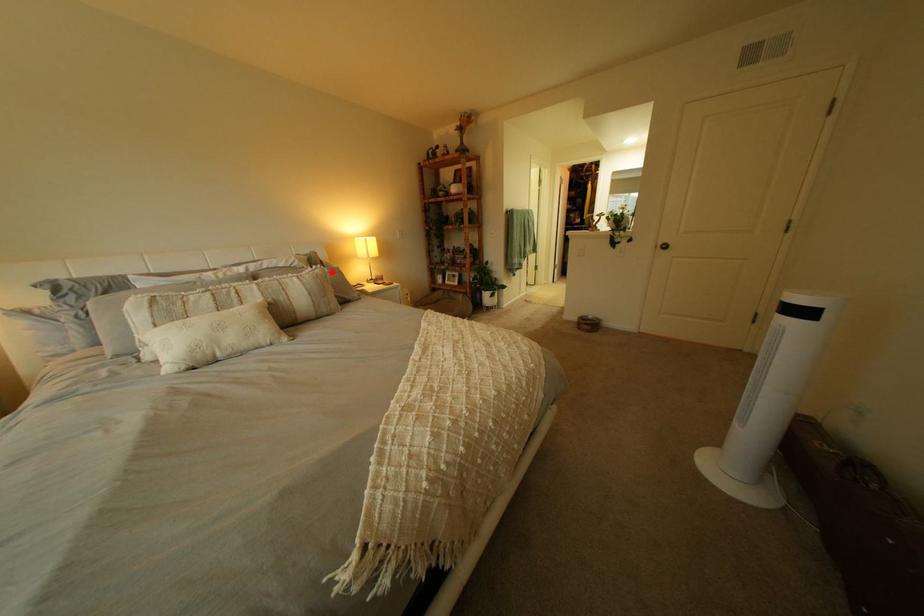
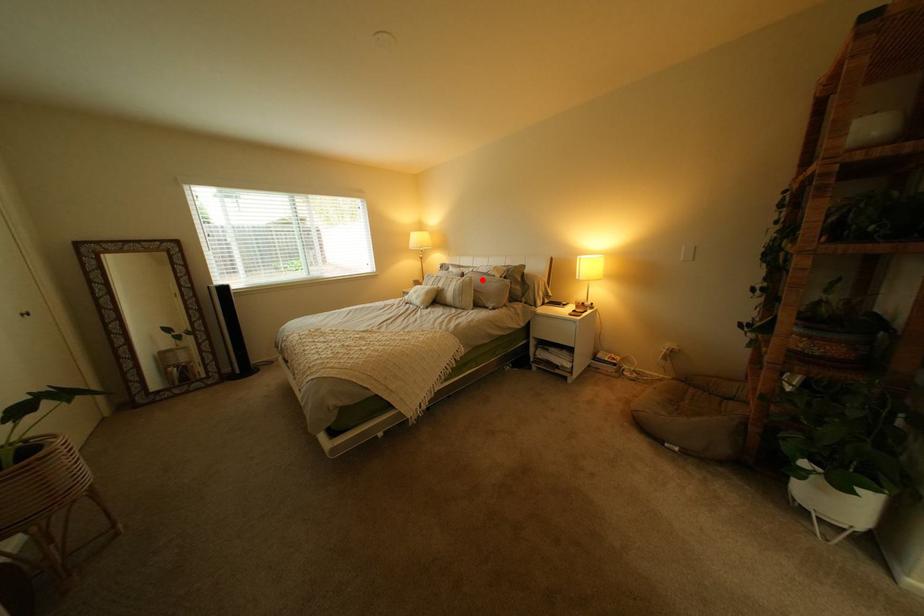
I am providing you with two images of the same scene from different viewpoints. A red point is marked on the first image and another point is marked on the second image. Are the points marked in image1 and image2 representing the same 3D position?

Yes